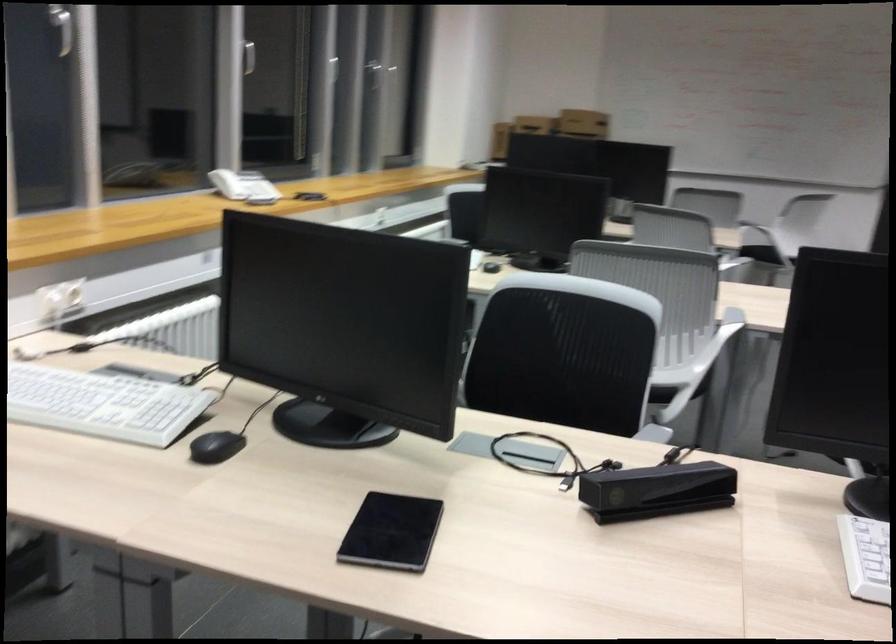
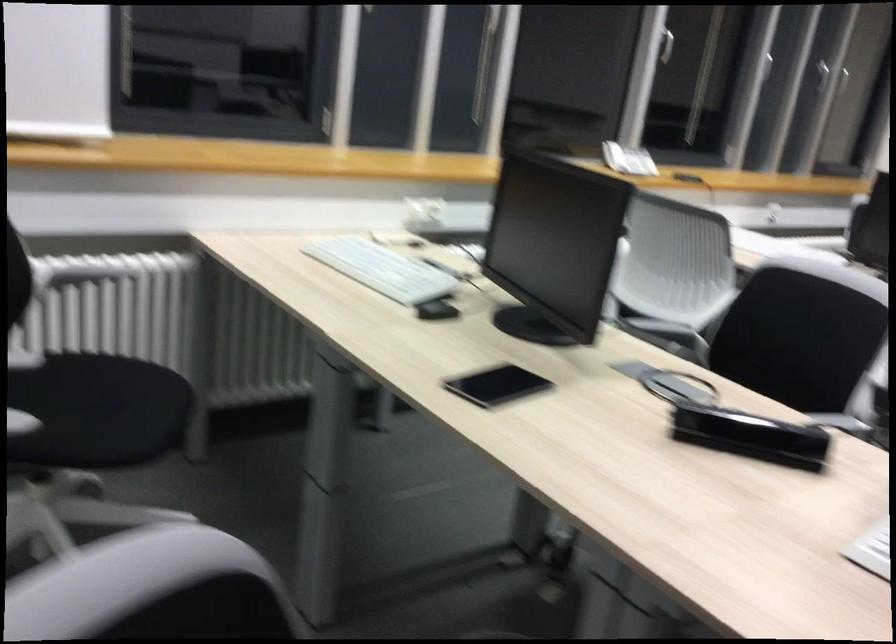
Locate, in the second image, the point that corresponds to pixel 184 427 in the first image.

(435, 297)